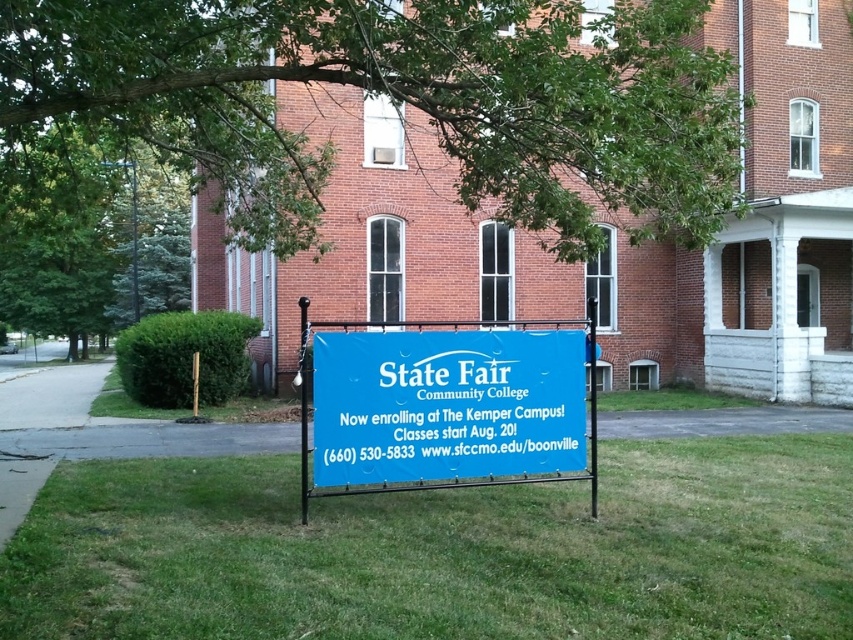
You are standing at the entrance of the brick building and want to find the blue signboard. According to the scene, where should you look relative to the green grass at center?

The blue signboard is located in the foreground, which is in front of the green grass at center since the green grass at center is positioned at point (x=444, y=550), indicating it is part of the central background area.

You are a visitor arriving at the campus and see the green grass at center and the blue fabric sign at center. According to the scene, which object is positioned to the left of the other?

The blue fabric sign at center is to the left of the green grass at center because the green grass at center is to the right of blue fabric sign at center.